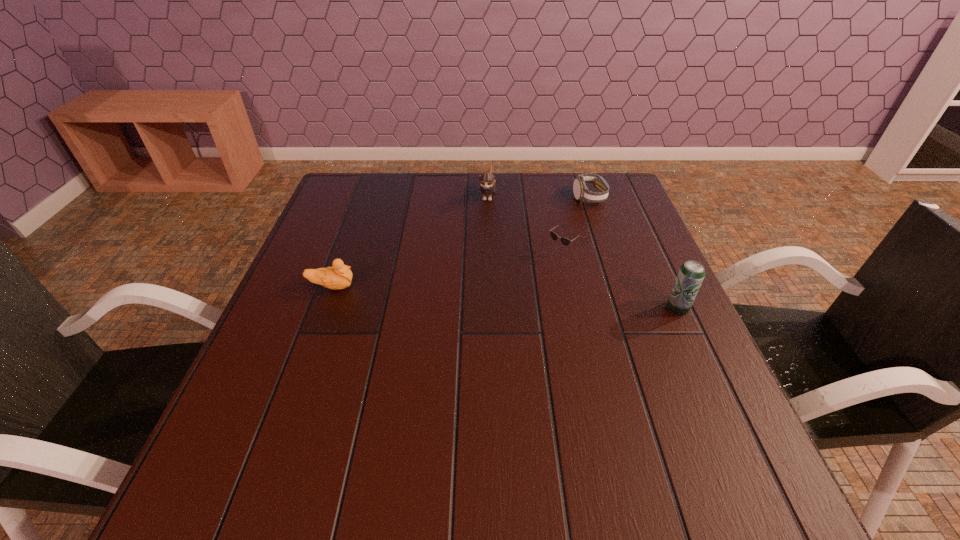
Image resolution: width=960 pixels, height=540 pixels. What are the coordinates of `watch situated at the far edge` in the screenshot? It's located at (581, 192).

Identify the location of kitten at the far edge. This screenshot has width=960, height=540. (487, 181).

Locate an element on the screen. object at the left edge is located at coordinates (339, 276).

At what (x,y) coordinates should I click in order to perform the action: click on beer can situated at the right edge. Please return your answer as a coordinate pair (x, y). Looking at the image, I should click on point(691,274).

Find the location of a particular element. This screenshot has height=540, width=960. watch at the right edge is located at coordinates (581, 192).

You are a GUI agent. You are given a task and a screenshot of the screen. Output one action in this format:
    pyautogui.click(x=<x>, y=<y>)
    Task: Click on the object located in the far right corner section of the desktop
    This screenshot has width=960, height=540.
    Given the screenshot: What is the action you would take?
    point(581,192)

Identify the location of free region at the far edge of the desktop. (441, 206).

Find the location of a particular element. vacant area at the near edge is located at coordinates (406, 426).

Find the location of a particular element. Image resolution: width=960 pixels, height=540 pixels. free location at the left edge is located at coordinates (339, 239).

The height and width of the screenshot is (540, 960). In the image, there is a desktop. In order to click on vacant space at the right edge in this screenshot , I will do `click(648, 258)`.